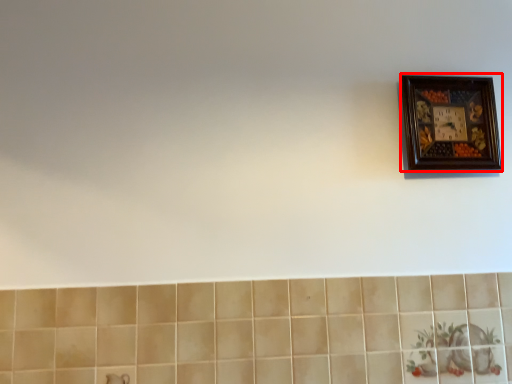
Question: In this image, where is picture frame (annotated by the red box) located relative to ceramic tile?

Choices:
 (A) left
 (B) right

Answer: (B)